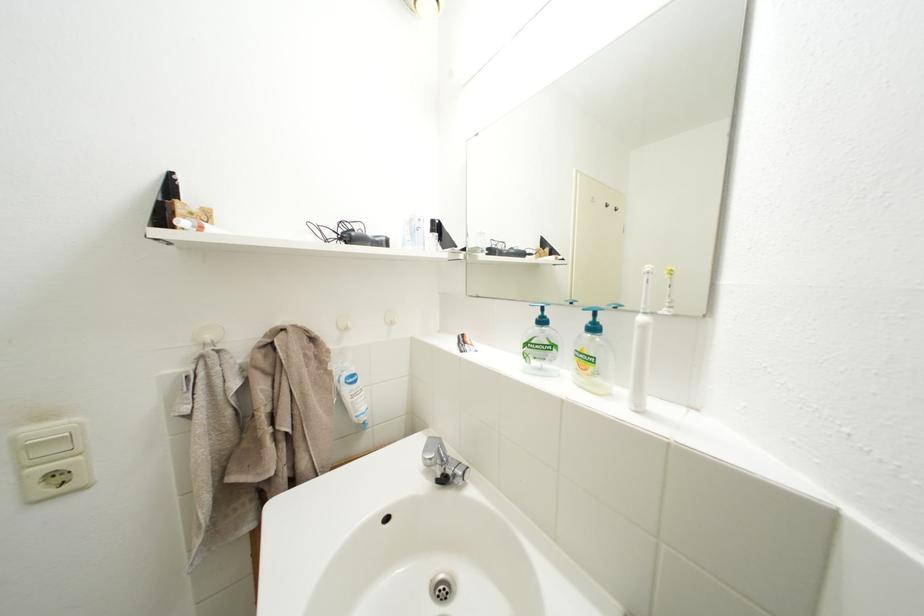
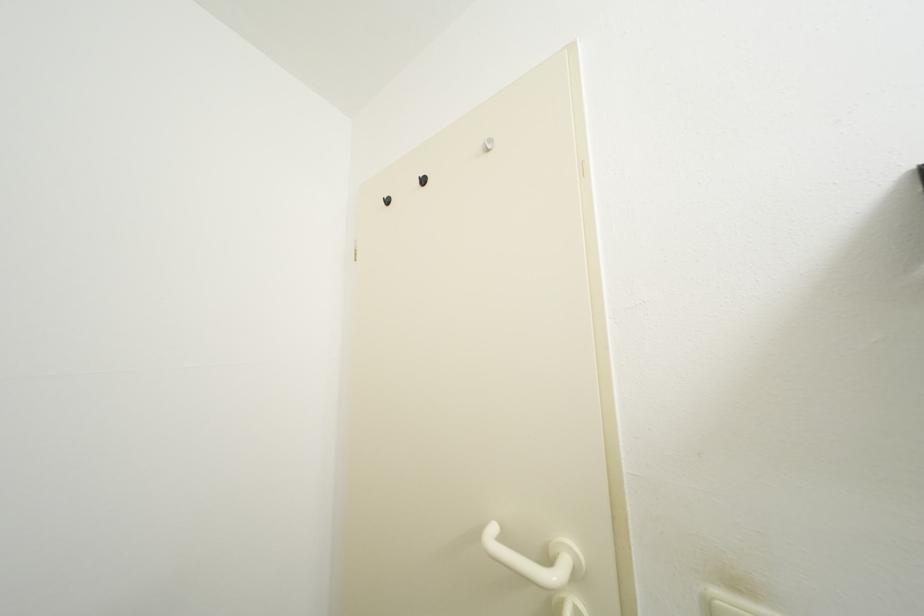
Question: The camera is either moving clockwise (left) or counter-clockwise (right) around the object. The first image is from the beginning of the video and the second image is from the end. Is the camera moving left or right when shooting the video?

Choices:
 (A) Left
 (B) Right

Answer: (B)